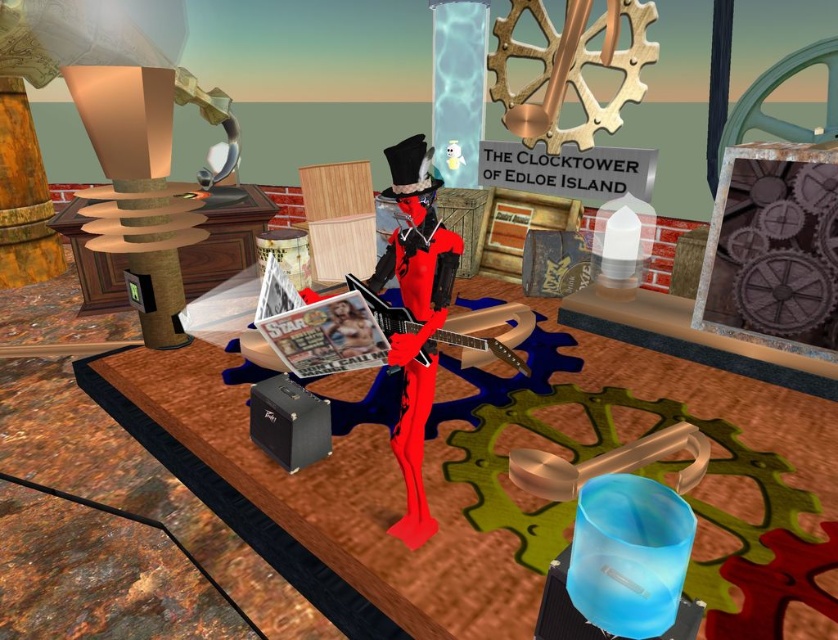
From the picture: You are a steampunk engineer inspecting the scene. You need to determine if the metallic gear at upper right can be attached to the shiny red figure at center without overlapping. Based on their sizes, is this possible?

The metallic gear at upper right has a lesser height compared to the shiny red figure at center, so it is possible to attach the metallic gear at upper right to the shiny red figure at center without overlapping as long as the gear is placed in an area where there is enough space.